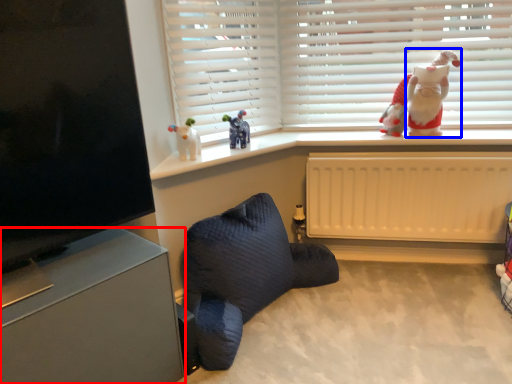
Question: Which object appears closest to the camera in this image, furniture (highlighted by a red box) or santa claus (highlighted by a blue box)?

Choices:
 (A) furniture
 (B) santa claus

Answer: (A)